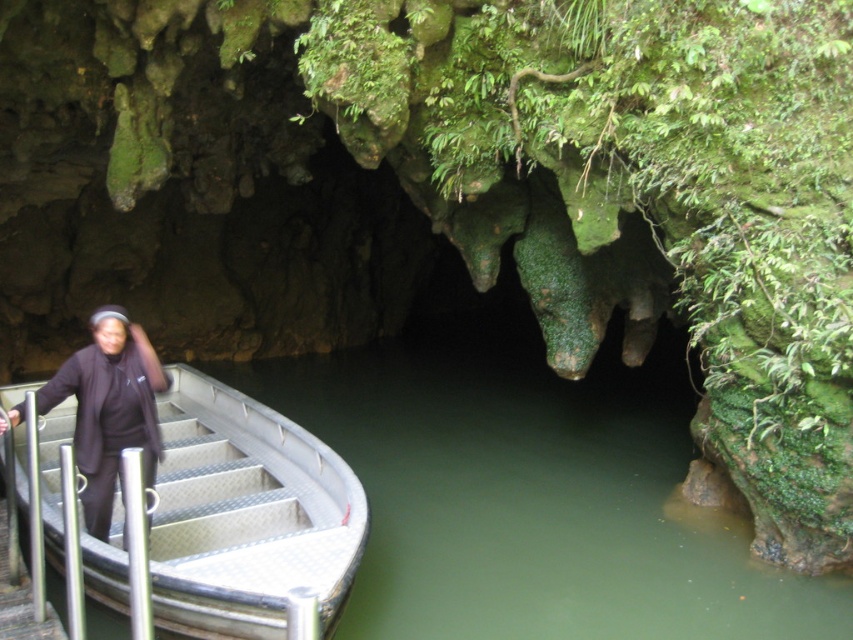
Question: Among these points, which one is farthest from the camera?

Choices:
 (A) (332, 468)
 (B) (122, 376)

Answer: (A)

Question: Among these objects, which one is farthest from the camera?

Choices:
 (A) black fabric headscarf at left
 (B) silver/aluminum boat at left

Answer: (A)

Question: Can you confirm if silver/aluminum boat at left is wider than black fabric headscarf at left?

Choices:
 (A) yes
 (B) no

Answer: (A)

Question: Is silver/aluminum boat at left to the left of black fabric headscarf at left from the viewer's perspective?

Choices:
 (A) no
 (B) yes

Answer: (A)

Question: Can you confirm if silver/aluminum boat at left is positioned below black fabric headscarf at left?

Choices:
 (A) yes
 (B) no

Answer: (A)